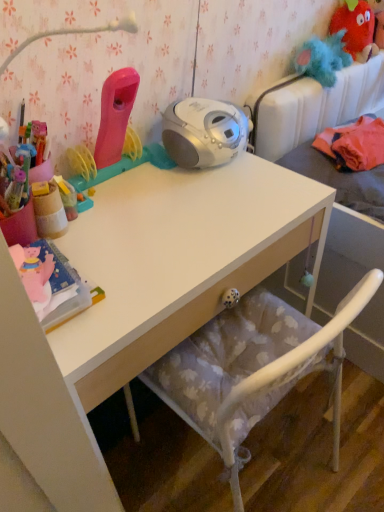
Question: Does white matte desk at center appear on the right side of fuzzy red monster at upper right?

Choices:
 (A) no
 (B) yes

Answer: (A)

Question: Does white matte desk at center have a larger size compared to fuzzy red monster at upper right?

Choices:
 (A) yes
 (B) no

Answer: (A)

Question: Can you confirm if white matte desk at center is shorter than fuzzy red monster at upper right?

Choices:
 (A) no
 (B) yes

Answer: (A)

Question: Is white matte desk at center wider than fuzzy red monster at upper right?

Choices:
 (A) no
 (B) yes

Answer: (B)

Question: Is white matte desk at center positioned with its back to fuzzy red monster at upper right?

Choices:
 (A) yes
 (B) no

Answer: (B)

Question: Relative to wooden pencil case at left, is fluffy fabric bed at upper right in front or behind?

Choices:
 (A) front
 (B) behind

Answer: (B)

Question: Is fluffy fabric bed at upper right to the left or to the right of wooden pencil case at left in the image?

Choices:
 (A) left
 (B) right

Answer: (B)

Question: Based on their sizes in the image, would you say fluffy fabric bed at upper right is bigger or smaller than wooden pencil case at left?

Choices:
 (A) small
 (B) big

Answer: (B)

Question: From the image's perspective, relative to wooden pencil case at left, is fluffy fabric bed at upper right above or below?

Choices:
 (A) below
 (B) above

Answer: (B)

Question: From a real-world perspective, relative to fluffy fabric bed at upper right, is fuzzy red monster at upper right vertically above or below?

Choices:
 (A) below
 (B) above

Answer: (B)

Question: Is point (349, 17) closer or farther from the camera than point (365, 337)?

Choices:
 (A) closer
 (B) farther

Answer: (B)

Question: Visually, is fuzzy red monster at upper right positioned to the left or to the right of fluffy fabric bed at upper right?

Choices:
 (A) left
 (B) right

Answer: (A)

Question: Considering their positions, is fuzzy red monster at upper right located in front of or behind fluffy fabric bed at upper right?

Choices:
 (A) front
 (B) behind

Answer: (B)

Question: From the image's perspective, is fuzzy red monster at upper right above or below white matte desk at center?

Choices:
 (A) below
 (B) above

Answer: (B)

Question: Is fuzzy red monster at upper right situated inside white matte desk at center or outside?

Choices:
 (A) inside
 (B) outside

Answer: (B)